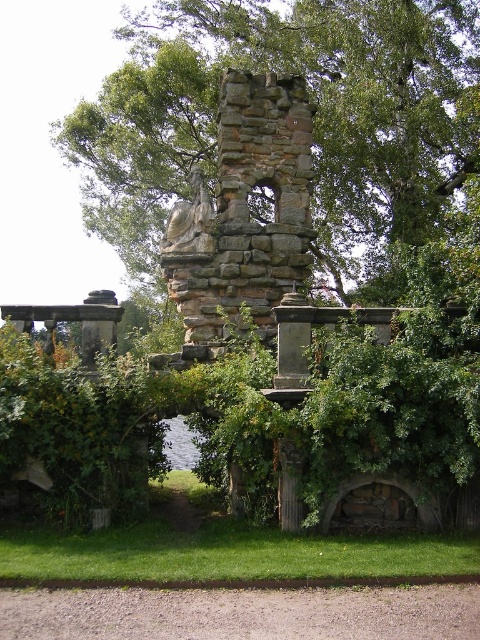
You are an archaeologist examining the ancient stone structure. You notice the green leafy tree at center and the rustic stone chimney at center. Which object is wider?

The green leafy tree at center is wider than the rustic stone chimney at center.

You are standing at point (314, 116) in the ancient stone structure. What do you see directly in front of you?

At point (314, 116) lies green leafy tree at center.